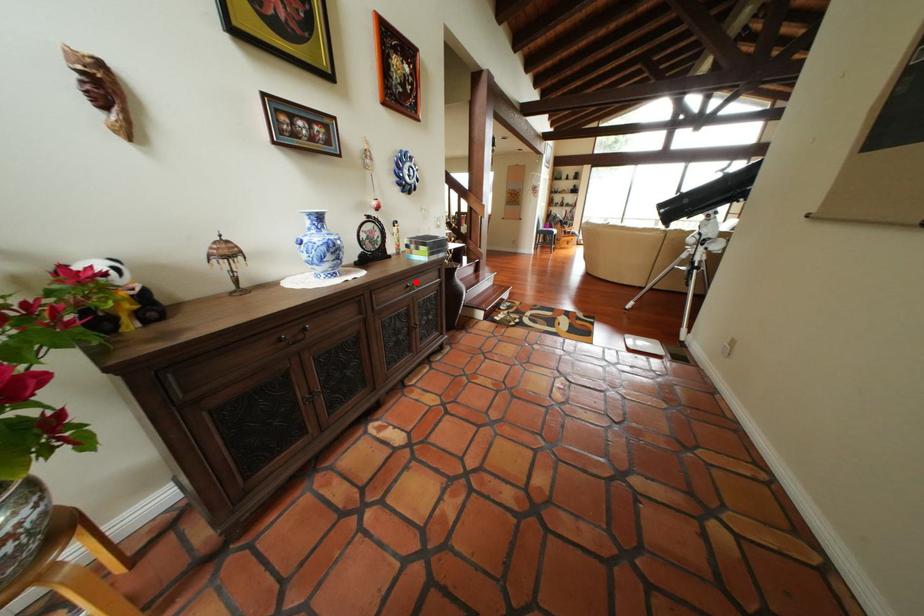
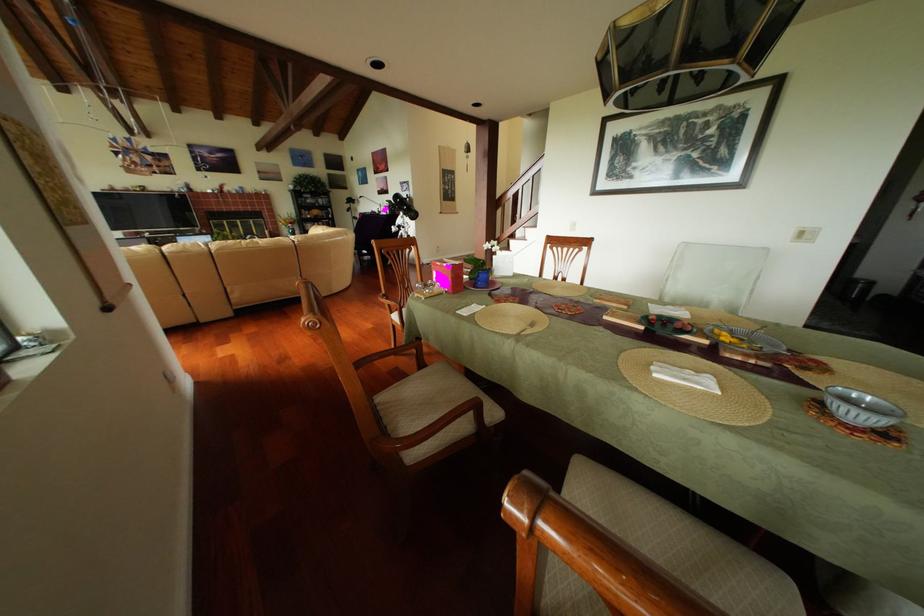
Question: I am providing you with two images of the same scene from different viewpoints. A red point is marked on the first image. Can you still see the location of the red point in image 2?

Choices:
 (A) Yes
 (B) No

Answer: (B)